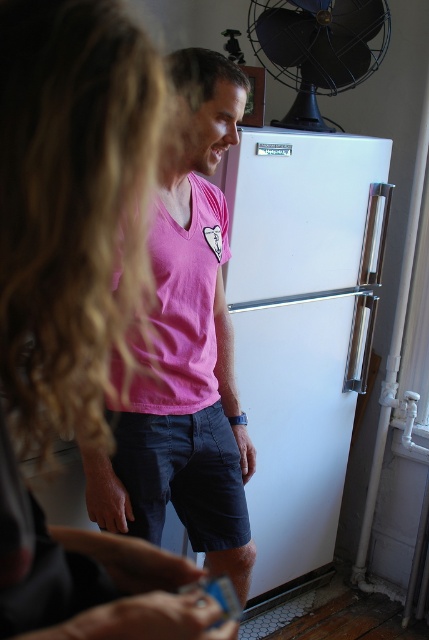
Image resolution: width=429 pixels, height=640 pixels. What do you see at coordinates (187, 349) in the screenshot?
I see `pink cotton shirt at center` at bounding box center [187, 349].

Who is shorter, pink cotton shirt at center or black metal fan at upper right?

With less height is black metal fan at upper right.

Is point (162, 298) more distant than point (295, 3)?

No, (162, 298) is closer to viewer.

Locate an element on the screen. This screenshot has width=429, height=640. pink cotton shirt at center is located at coordinates (187, 349).

Does white matte refrigerator at right appear over black metal fan at upper right?

No, white matte refrigerator at right is not above black metal fan at upper right.

Is point (338, 221) positioned in front of point (329, 35)?

That is True.

Who is more forward, [344,212] or [341,84]?

Point [344,212]

At what (x,y) coordinates should I click in order to perform the action: click on white matte refrigerator at right. Please return your answer as a coordinate pair (x, y). Looking at the image, I should click on (301, 324).

Who is positioned more to the right, blonde hair at upper left or white matte refrigerator at right?

white matte refrigerator at right is more to the right.

Does blonde hair at upper left have a lesser width compared to white matte refrigerator at right?

Indeed, blonde hair at upper left has a lesser width compared to white matte refrigerator at right.

Image resolution: width=429 pixels, height=640 pixels. Describe the element at coordinates (72, 208) in the screenshot. I see `blonde hair at upper left` at that location.

The image size is (429, 640). Identify the location of blonde hair at upper left. (72, 208).